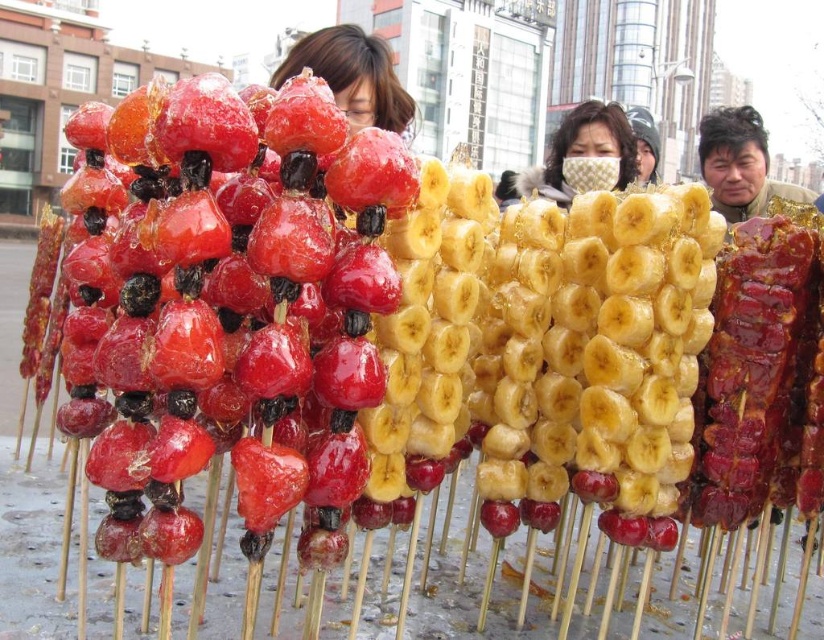
Question: Which of the following is the closest to the observer?

Choices:
 (A) (564, 131)
 (B) (541, 284)
 (C) (738, 122)

Answer: (B)

Question: Which point is closer to the camera?

Choices:
 (A) (723, 204)
 (B) (675, 461)

Answer: (B)

Question: Can you confirm if yellow/golden smooth banana at center is wider than smooth brown jacket at right?

Choices:
 (A) no
 (B) yes

Answer: (A)

Question: Is yellow/golden smooth banana at center to the right of patterned fabric face mask at center from the viewer's perspective?

Choices:
 (A) no
 (B) yes

Answer: (A)

Question: Which of these objects is positioned farthest from the patterned fabric face mask at center?

Choices:
 (A) smooth brown jacket at right
 (B) yellow/golden smooth banana at center

Answer: (B)

Question: Does patterned fabric face mask at center have a smaller size compared to smooth brown jacket at right?

Choices:
 (A) yes
 (B) no

Answer: (A)